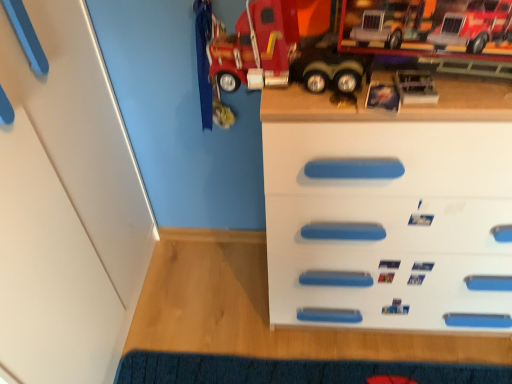
This screenshot has height=384, width=512. What are the coordinates of `blank space situated above blue textured mat at lower center (from a real-world perspective)` in the screenshot? It's located at (304, 370).